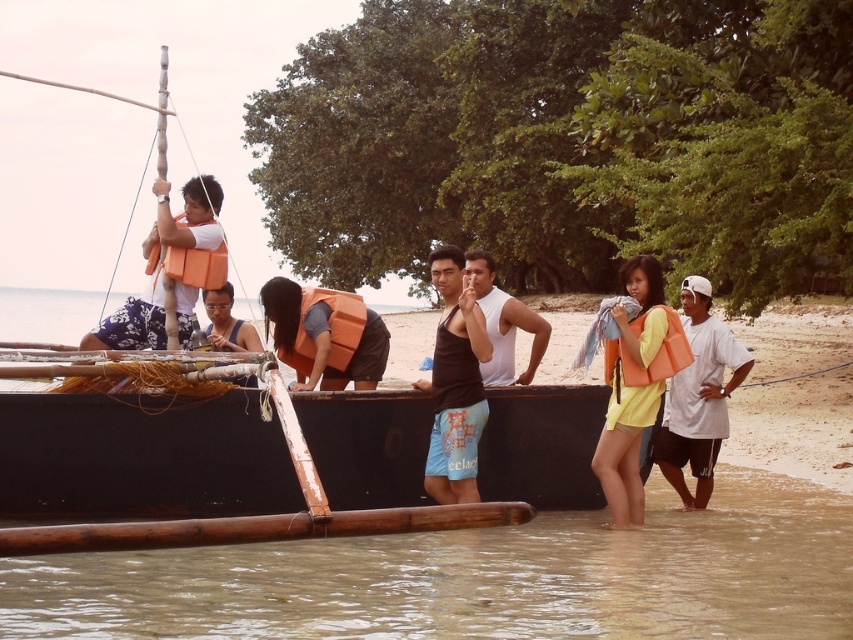
You are a safety inspector checking the placement of life vests and life jackets on a boat. You notice both the orange life vest at right and the orange foam life jacket at right. According to safety regulations, life vests must be placed to the left of life jackets. Is the current arrangement compliant?

The orange life vest at right is to the right of the orange foam life jacket at right, which violates the safety regulation requiring life vests to be placed to the left of life jackets. The current arrangement is not compliant.

You are a lifeguard on duty at the beach and notice a person in distress near the boat. You have a rescue buoy that you can throw. Looking at the image, where is the closest object to the point marked by coordinates point (631, 394) that you can use for the rescue?

The closest object to point (631, 394) is the matte orange life vest at right, which is located at those coordinates. You can retrieve it quickly for the rescue.

You are a photographer trying to capture both the black tank top at center and the orange life vest at left in a single shot. Since you want to ensure both are in focus, which one should you focus on first to make sure the other is also in focus?

You should focus on the black tank top at center first because it is closer to the camera than the orange life vest at left. By focusing on the closer object, the background object will still be in focus due to the depth of field.